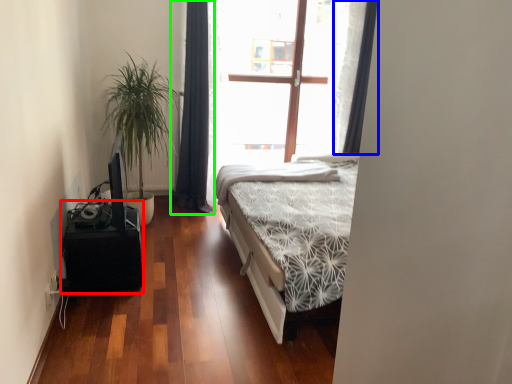
Question: Considering the real-world distances, which object is farthest from table (highlighted by a red box)? curtain (highlighted by a blue box) or curtain (highlighted by a green box)?

Choices:
 (A) curtain
 (B) curtain

Answer: (A)